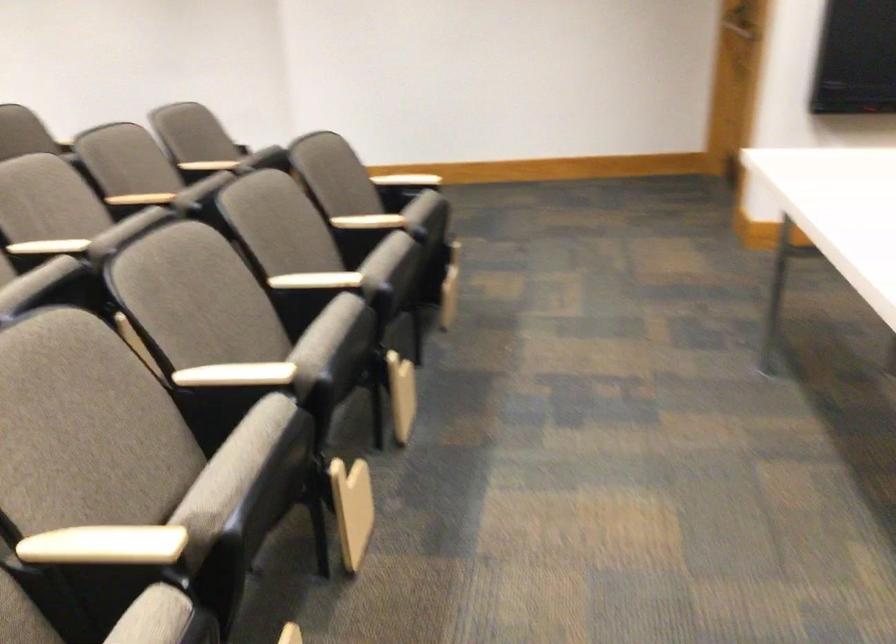
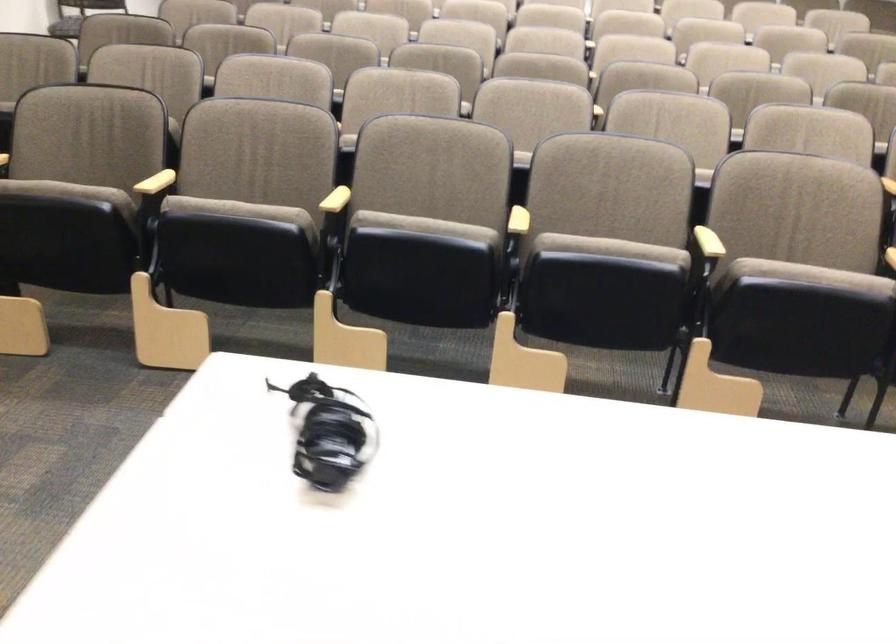
Locate, in the second image, the point that corresponds to (131,535) in the first image.

(336, 200)